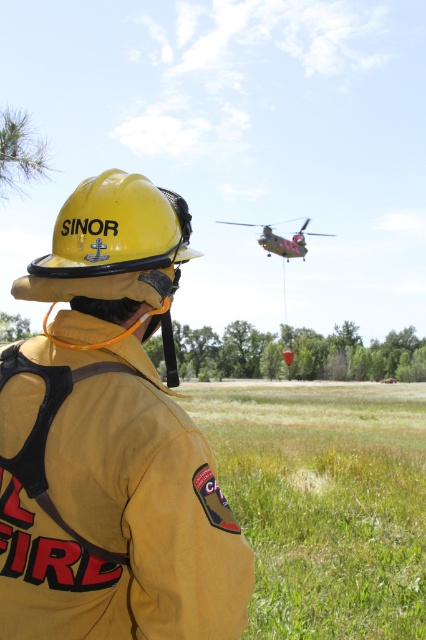
Question: Is green grass at center above green matte helicopter at upper center?

Choices:
 (A) yes
 (B) no

Answer: (B)

Question: Which point is farther to the camera?

Choices:
 (A) green grass at center
 (B) yellow fireman at center
 (C) yellow matte helmet at center

Answer: (A)

Question: Which object is the closest to the green matte helicopter at upper center?

Choices:
 (A) green grass at center
 (B) yellow fireman at center
 (C) yellow matte helmet at center

Answer: (A)

Question: Which object is closer to the camera taking this photo?

Choices:
 (A) green matte helicopter at upper center
 (B) yellow matte helmet at center

Answer: (B)

Question: Is the position of yellow fireman at center less distant than that of green grass at center?

Choices:
 (A) yes
 (B) no

Answer: (A)

Question: In this image, where is yellow fireman at center located relative to green matte helicopter at upper center?

Choices:
 (A) below
 (B) above

Answer: (A)